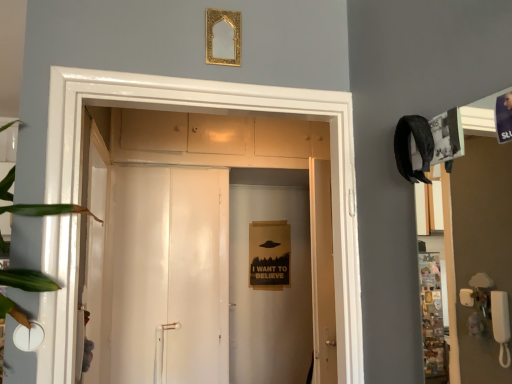
Question: Is white glossy door at center bigger than green leafy plant at left?

Choices:
 (A) no
 (B) yes

Answer: (B)

Question: Is white glossy door at center further to the viewer compared to green leafy plant at left?

Choices:
 (A) yes
 (B) no

Answer: (A)

Question: Does white glossy door at center have a lesser width compared to green leafy plant at left?

Choices:
 (A) no
 (B) yes

Answer: (A)

Question: Does white glossy door at center appear on the left side of green leafy plant at left?

Choices:
 (A) yes
 (B) no

Answer: (B)

Question: From the image's perspective, would you say white glossy door at center is shown under green leafy plant at left?

Choices:
 (A) yes
 (B) no

Answer: (A)

Question: Is point (10, 311) closer or farther from the camera than point (216, 44)?

Choices:
 (A) closer
 (B) farther

Answer: (A)

Question: Is green leafy plant at left inside the boundaries of gold ornate mirror at upper center, or outside?

Choices:
 (A) inside
 (B) outside

Answer: (B)

Question: From a real-world perspective, is green leafy plant at left positioned above or below gold ornate mirror at upper center?

Choices:
 (A) above
 (B) below

Answer: (B)

Question: From the image's perspective, is green leafy plant at left positioned above or below gold ornate mirror at upper center?

Choices:
 (A) above
 (B) below

Answer: (B)

Question: Looking at their shapes, would you say gold ornate mirror at upper center is wider or thinner than green leafy plant at left?

Choices:
 (A) thin
 (B) wide

Answer: (A)

Question: Is gold ornate mirror at upper center bigger or smaller than green leafy plant at left?

Choices:
 (A) big
 (B) small

Answer: (B)

Question: From a real-world perspective, is gold ornate mirror at upper center physically located above or below green leafy plant at left?

Choices:
 (A) below
 (B) above

Answer: (B)

Question: From the image's perspective, is gold ornate mirror at upper center positioned above or below green leafy plant at left?

Choices:
 (A) below
 (B) above

Answer: (B)

Question: In terms of width, does green leafy plant at left look wider or thinner when compared to white glossy door at center?

Choices:
 (A) wide
 (B) thin

Answer: (B)

Question: Does point (8, 196) appear closer or farther from the camera than point (252, 125)?

Choices:
 (A) closer
 (B) farther

Answer: (A)